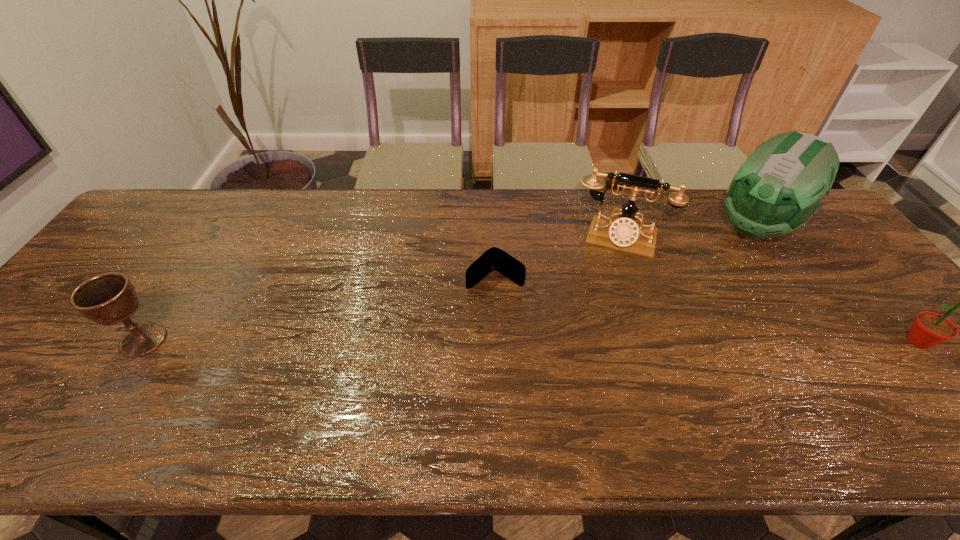
Where is `the leftmost object`? The width and height of the screenshot is (960, 540). the leftmost object is located at coordinates (109, 298).

Locate an element on the screen. The height and width of the screenshot is (540, 960). chalice is located at coordinates (109, 298).

The width and height of the screenshot is (960, 540). I want to click on sunflower, so click(x=929, y=328).

Locate an element on the screen. The image size is (960, 540). the third object from right to left is located at coordinates (623, 233).

Find the location of a particular element. the third farthest object is located at coordinates (494, 258).

Identify the location of the fourth object from right to left. The height and width of the screenshot is (540, 960). (494, 258).

This screenshot has height=540, width=960. In order to click on the second object from right to left in this screenshot , I will do `click(779, 187)`.

Where is `football helmet`? The height and width of the screenshot is (540, 960). football helmet is located at coordinates (779, 187).

Locate an element on the screen. The height and width of the screenshot is (540, 960). free space located 0.360m on the right of the leftmost object is located at coordinates (315, 340).

Locate an element on the screen. This screenshot has width=960, height=540. free location located on the dial of the telephone is located at coordinates (589, 339).